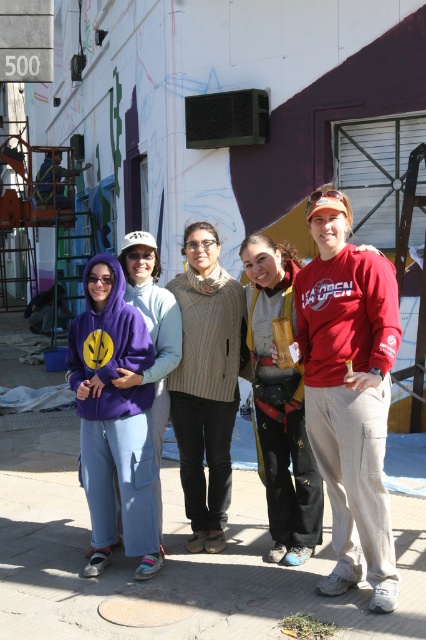
Can you confirm if matte yellow vest at center is wider than red cotton sweatshirt at right?

No, matte yellow vest at center is not wider than red cotton sweatshirt at right.

Who is positioned more to the left, matte yellow vest at center or red cotton sweatshirt at right?

From the viewer's perspective, matte yellow vest at center appears more on the left side.

Who is more distant from viewer, (285, 428) or (389, 316)?

The point (285, 428) is more distant.

Find the location of a particular element. The image size is (426, 640). matte yellow vest at center is located at coordinates (279, 404).

Is point (267, 252) positioned before point (238, 324)?

That is True.

From the picture: Is matte yellow vest at center to the right of beige knitted sweater at center from the viewer's perspective?

Correct, you'll find matte yellow vest at center to the right of beige knitted sweater at center.

The height and width of the screenshot is (640, 426). Describe the element at coordinates (279, 404) in the screenshot. I see `matte yellow vest at center` at that location.

Identify the location of matte yellow vest at center. (279, 404).

Who is higher up, matte yellow vest at center or purple fleece sweatshirt at left?

Positioned higher is purple fleece sweatshirt at left.

Can you confirm if matte yellow vest at center is smaller than purple fleece sweatshirt at left?

Incorrect, matte yellow vest at center is not smaller in size than purple fleece sweatshirt at left.

This screenshot has width=426, height=640. What do you see at coordinates (279, 404) in the screenshot? I see `matte yellow vest at center` at bounding box center [279, 404].

Identify the location of matte yellow vest at center. (279, 404).